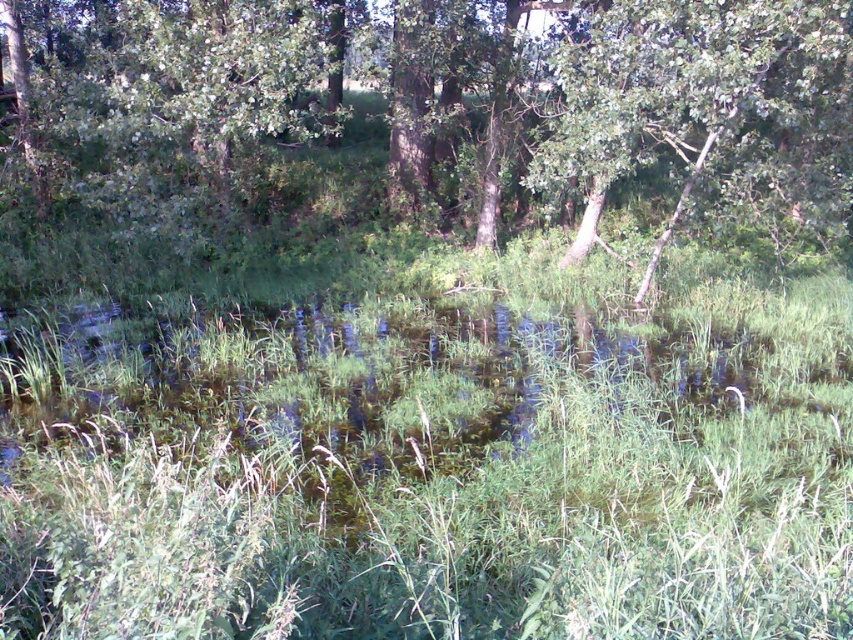
Looking at this image, you are a bird flying over the wetland and want to land on the tallest tree. Which tree should you choose between the green leafy tree at center and the green leafy tree at upper center?

The green leafy tree at center is taller than the green leafy tree at upper center, so you should choose the green leafy tree at center to land on.

You are standing in the wetland area and want to walk towards the trees. Which tree should you approach first, the green leafy tree at center or the green leafy tree at upper center?

You should approach the green leafy tree at center first because it is closer to you than the green leafy tree at upper center.

You are standing at the point with coordinates 0.2, 0.5 in the wetland scene. Which object from the following list is closest to your current position? The options are the green leafy tree at center and the tall grasses and reeds in the foreground.

The green leafy tree at center is located at point (x=430, y=109), so it is closer to your position at (x=426, y=128) compared to the tall grasses and reeds in the foreground.